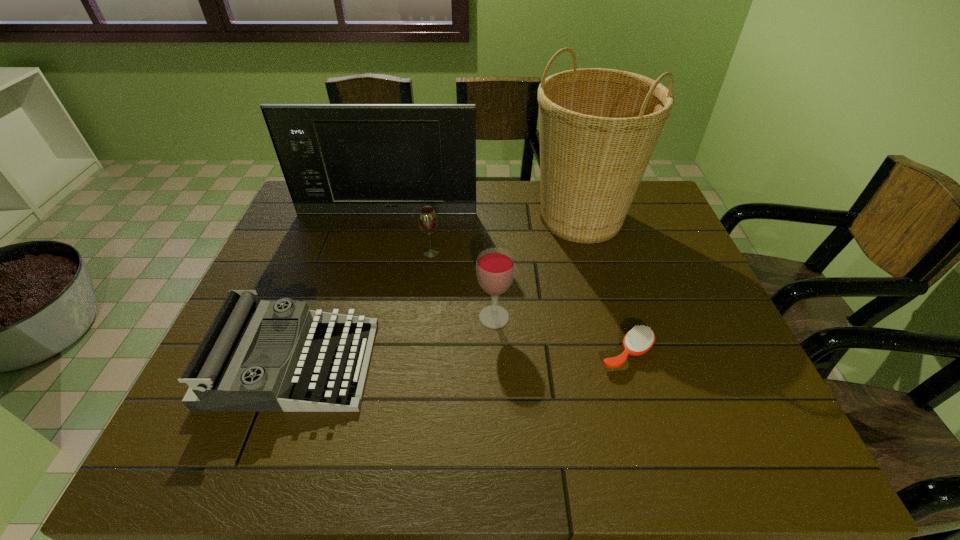
The height and width of the screenshot is (540, 960). What are the coordinates of `free region located 0.110m on the right of the right wineglass` in the screenshot? It's located at (556, 317).

Identify the location of blank area located on the right of the farther wineglass. (544, 252).

Find the location of a particular element. This screenshot has height=540, width=960. free space located 0.130m on the typing side of the typewriter is located at coordinates [x=427, y=363].

I want to click on vacant space positioned on the back of the hairbrush, so click(x=597, y=252).

Locate an element on the screen. This screenshot has height=540, width=960. basket at the far edge is located at coordinates (598, 128).

At what (x,y) coordinates should I click in order to perform the action: click on microwave oven at the far edge. Please return your answer as a coordinate pair (x, y). The image size is (960, 540). Looking at the image, I should click on (346, 159).

At what (x,y) coordinates should I click in order to perform the action: click on microwave oven positioned at the left edge. Please return your answer as a coordinate pair (x, y). The height and width of the screenshot is (540, 960). Looking at the image, I should click on (346, 159).

This screenshot has height=540, width=960. In order to click on typewriter positioned at the left edge in this screenshot , I will do `click(257, 356)`.

You are a GUI agent. You are given a task and a screenshot of the screen. Output one action in this format:
    pyautogui.click(x=<x>, y=<y>)
    Task: Click on the object located at the right edge
    This screenshot has height=540, width=960.
    Given the screenshot: What is the action you would take?
    pyautogui.click(x=598, y=128)

Where is `object that is at the far left corner`? object that is at the far left corner is located at coordinates (346, 159).